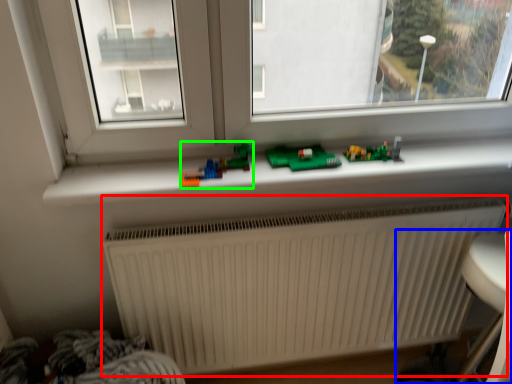
Question: Which object is positioned closest to radiator (highlighted by a red box)? Select from armchair (highlighted by a blue box) and toy (highlighted by a green box).

Choices:
 (A) armchair
 (B) toy

Answer: (A)